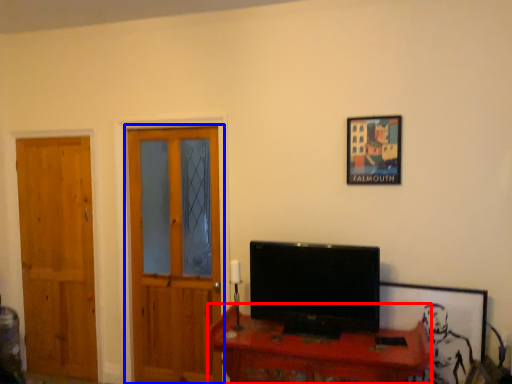
Question: Which of the following is the closest to the observer, desk (highlighted by a red box) or door (highlighted by a blue box)?

Choices:
 (A) desk
 (B) door

Answer: (A)